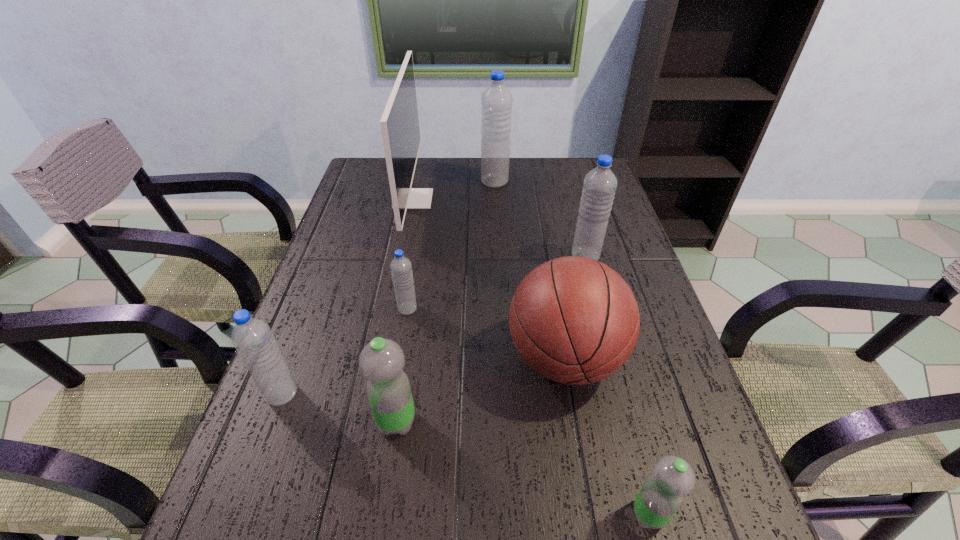
You are a GUI agent. You are given a task and a screenshot of the screen. Output one action in this format:
    pyautogui.click(x=<x>, y=<y>)
    Task: Click on the vacant space located 0.330m on the front of the third farthest water bottle
    This screenshot has width=960, height=540.
    Given the screenshot: What is the action you would take?
    pyautogui.click(x=385, y=450)

Image resolution: width=960 pixels, height=540 pixels. In order to click on blank area located 0.390m on the left of the nearer green water bottle in this screenshot , I will do `click(396, 514)`.

This screenshot has height=540, width=960. I want to click on monitor positioned at the far edge, so click(399, 123).

At what (x,y) coordinates should I click in order to perform the action: click on water bottle at the far edge. Please return your answer as a coordinate pair (x, y). Looking at the image, I should click on (496, 101).

Locate an element on the screen. This screenshot has width=960, height=540. monitor at the left edge is located at coordinates (399, 123).

Locate an element on the screen. water bottle that is positioned at the left edge is located at coordinates (255, 343).

I want to click on basketball at the right edge, so click(x=574, y=320).

Find the location of `object located at the far left corner`. object located at the far left corner is located at coordinates (399, 123).

This screenshot has width=960, height=540. What are the coordinates of `free region at the far edge of the desktop` in the screenshot? It's located at (418, 176).

I want to click on free space at the left edge of the desktop, so click(258, 461).